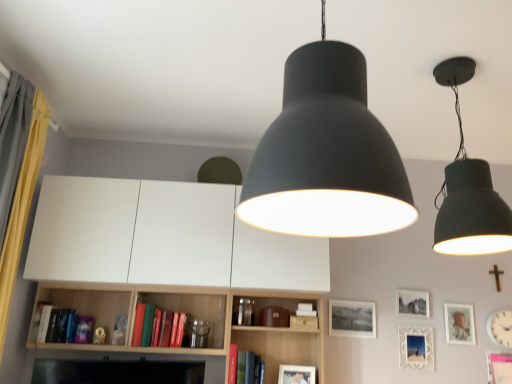
Identify the location of free point above matte black lampshade at upper right, the 1th lamp viewed from the back (from a real-world perspective). The image size is (512, 384). (453, 57).